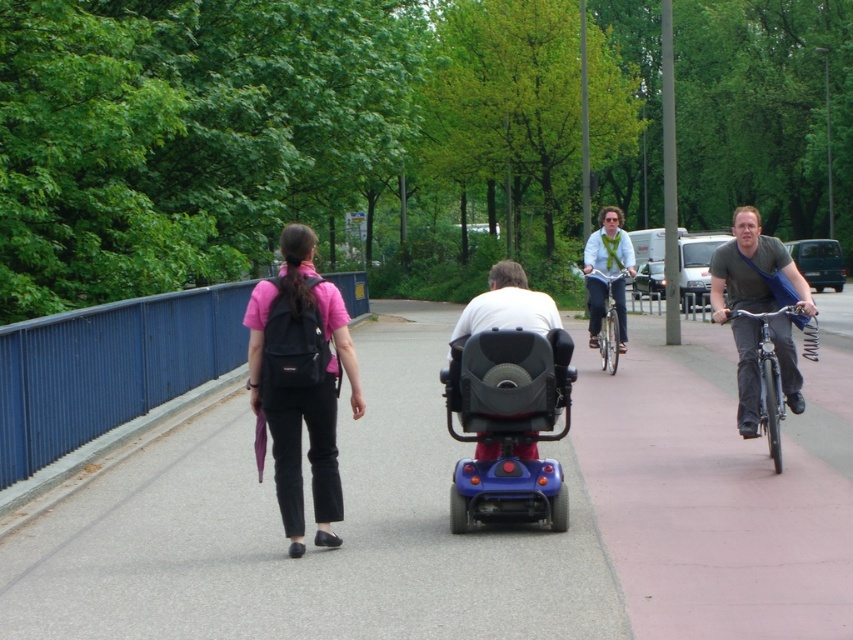
Is black fabric backpack at left wider than matte black scooter at center?

In fact, black fabric backpack at left might be narrower than matte black scooter at center.

Based on the photo, who is shorter, black fabric backpack at left or matte black scooter at center?

matte black scooter at center is shorter.

What do you see at coordinates (300, 381) in the screenshot? I see `black fabric backpack at left` at bounding box center [300, 381].

This screenshot has height=640, width=853. What are the coordinates of `black fabric backpack at left` in the screenshot? It's located at (300, 381).

Which is behind, point (302, 531) or point (732, 284)?

The point (732, 284) is behind.

Is black fabric backpack at left to the right of matte gray shirt at right from the viewer's perspective?

In fact, black fabric backpack at left is to the left of matte gray shirt at right.

Image resolution: width=853 pixels, height=640 pixels. What are the coordinates of `black fabric backpack at left` in the screenshot? It's located at (300, 381).

Does gray asphalt at center have a greater height compared to blue plastic mobility scooter at center?

No, gray asphalt at center is not taller than blue plastic mobility scooter at center.

Is point (125, 605) closer to camera compared to point (553, 518)?

Yes, point (125, 605) is in front of point (553, 518).

Find the location of a particular element. The image size is (853, 640). gray asphalt at center is located at coordinates (306, 532).